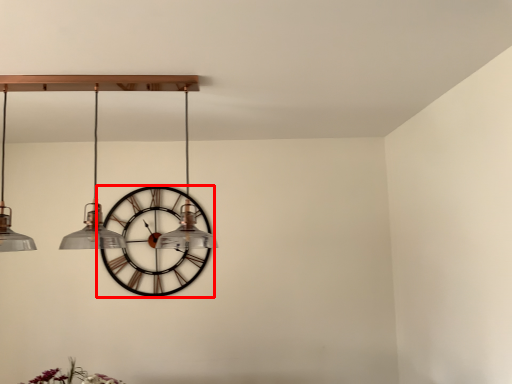
Question: Where is wall clock (annotated by the red box) located in relation to chandelier in the image?

Choices:
 (A) left
 (B) right

Answer: (A)